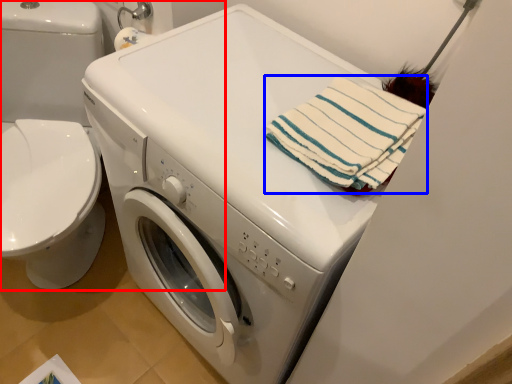
Question: Which object appears farthest to the camera in this image, washer (highlighted by a red box) or beach towel (highlighted by a blue box)?

Choices:
 (A) washer
 (B) beach towel

Answer: (A)